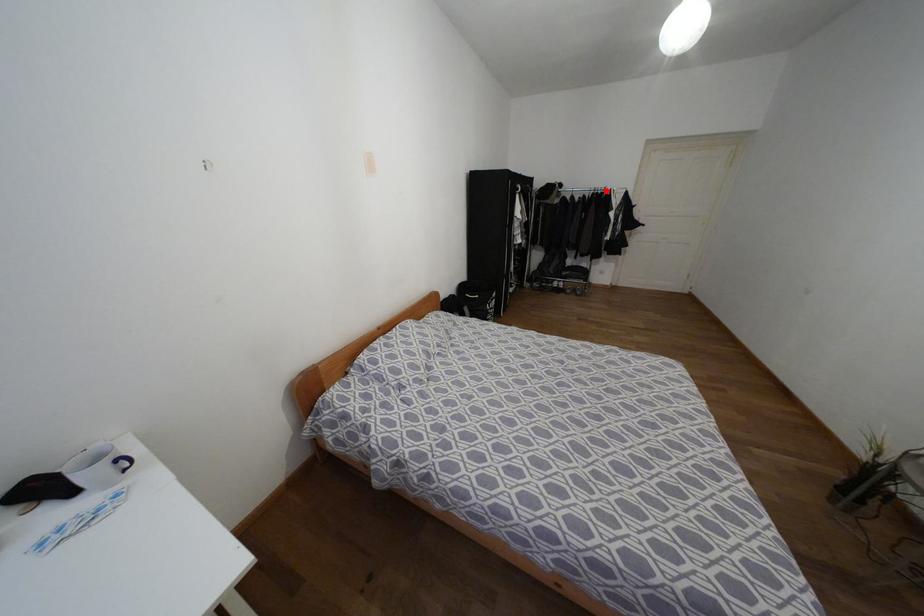
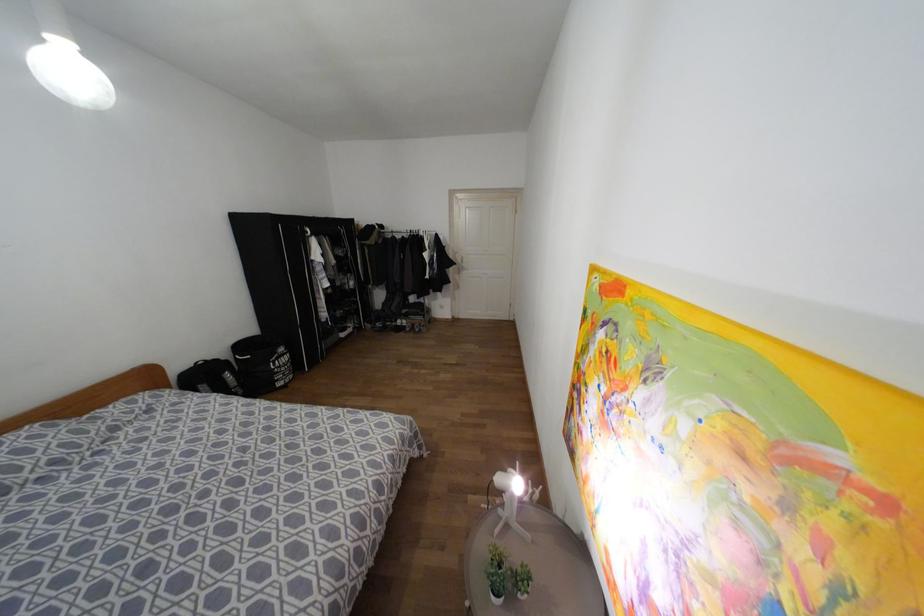
Question: I am providing you with two images of the same scene from different viewpoints. A red point is marked on the first image. At the location where the point appears in image 1, is it still visible in image 2?

Choices:
 (A) Yes
 (B) No

Answer: (A)